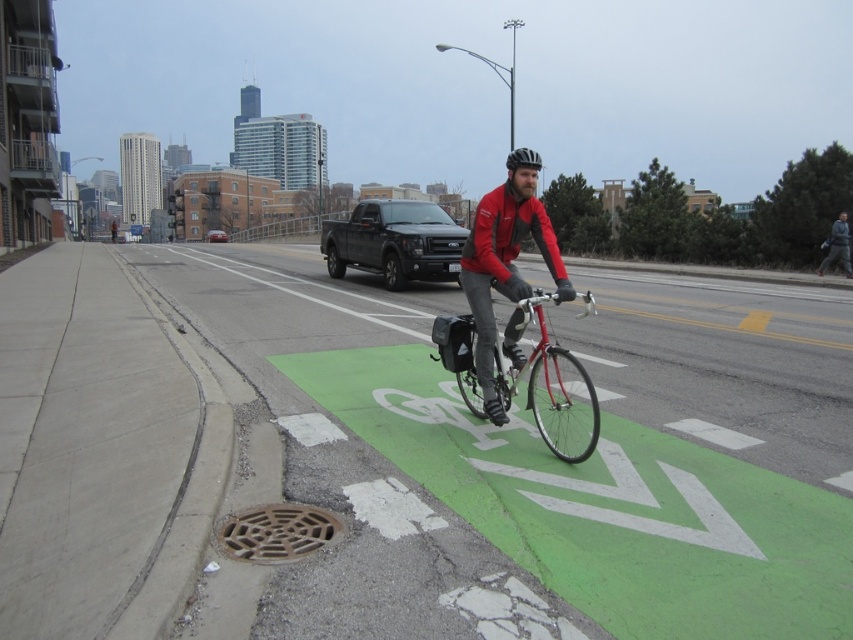
You are standing at the point marked by the coordinates point (498, 388) in the scene. You want to cross the road to reach a coffee shop located on the opposite side. However, there is a cyclist moving towards you in the bike lane. The cyclist is currently 5.18 meters away from you. If the cyclist is moving at a constant speed of 15 km per hour, how much time do you have before the cyclist reaches your current position?

The cyclist is 5.18 meters away and moving at 15 km per hour. Converting 15 km per hour to meters per second gives approximately 4.17 m per second. Dividing the distance by speed gives 5.18 meters divided by 4.17 m per second equals approximately 1.24 seconds. Therefore, you have about 1.24 seconds before the cyclist reaches your current position at point (498, 388).

You are a city planner analyzing the bike lane layout. The matte red jacket at center is part of a cyclist in the bike lane. Based on the coordinates provided, is the cyclist positioned closer to the left or right side of the bike lane?

The coordinates of the matte red jacket at center are at point (x=503, y=266). Since the bike lane is on the right side of the road, the cyclist is positioned closer to the right side of the bike lane.

You are a delivery person on a bike and need to know if your bike can fit through a narrow alleyway entrance that is the same height as the green painted bike lane at center. The entrance is too low for helmets taller than the bike lane. Can your bike with the black matte helmet at center pass through?

The green painted bike lane at center is not as tall as the black matte helmet at center, meaning the helmet is taller. Since the entrance is too low for helmets taller than the bike lane, the black matte helmet at center would not fit, so the bike cannot pass through with the helmet on.